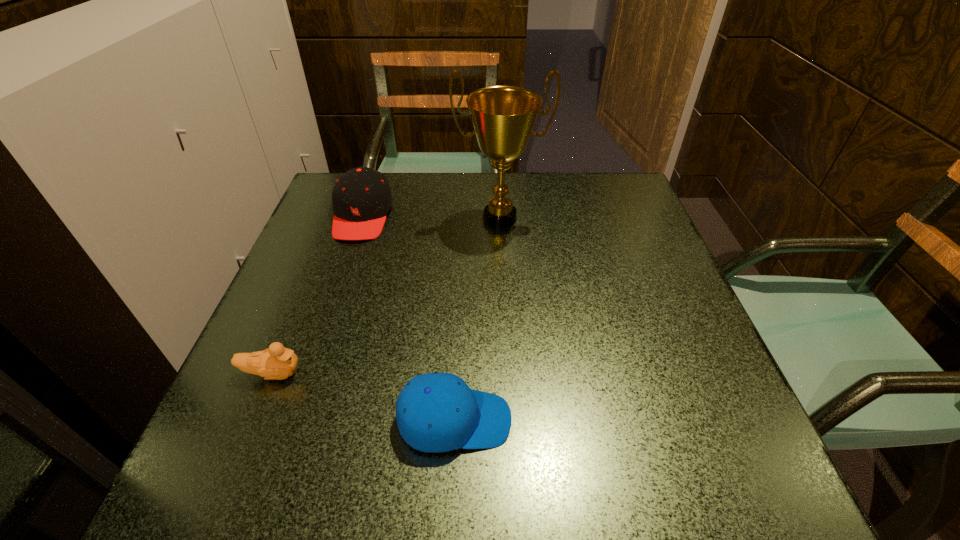
You are a GUI agent. You are given a task and a screenshot of the screen. Output one action in this format:
    pyautogui.click(x=<x>, y=<y>)
    Task: Click on the free spot between the left cap and the duckling
    The image size is (960, 540).
    Given the screenshot: What is the action you would take?
    pyautogui.click(x=318, y=295)

Where is `blank region between the right cap and the tallest object`? This screenshot has height=540, width=960. blank region between the right cap and the tallest object is located at coordinates click(477, 319).

Locate an element on the screen. vacant space that is in between the third farthest object and the shorter cap is located at coordinates pos(364,397).

I want to click on object that stands as the third closest to the award, so click(276, 363).

You are a GUI agent. You are given a task and a screenshot of the screen. Output one action in this format:
    pyautogui.click(x=<x>, y=<y>)
    Task: Click on the object that is the second closest to the left cap
    
    Given the screenshot: What is the action you would take?
    pyautogui.click(x=276, y=363)

Where is `vacant space that satisfies the following two spatial constraints: 1. on the front-facing side of the left cap; 2. on the face of the third farthest object`? The image size is (960, 540). vacant space that satisfies the following two spatial constraints: 1. on the front-facing side of the left cap; 2. on the face of the third farthest object is located at coordinates (309, 374).

The image size is (960, 540). I want to click on vacant space that satisfies the following two spatial constraints: 1. on the front view with handles of the tallest object; 2. on the front-facing side of the right cap, so click(x=512, y=420).

I want to click on free space that satisfies the following two spatial constraints: 1. on the front view with handles of the award; 2. on the front-facing side of the nearest object, so click(512, 420).